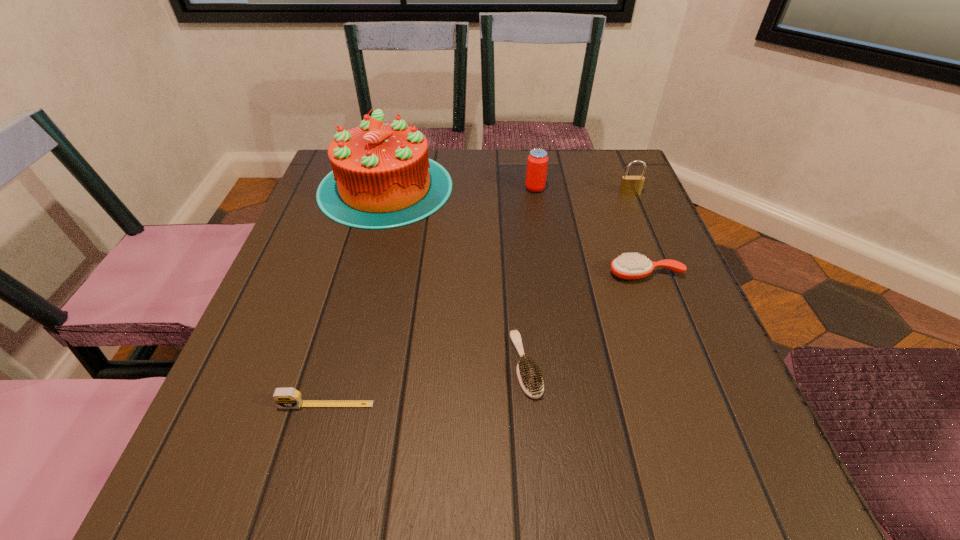
This screenshot has width=960, height=540. Find the location of `free spot located 0.240m on the left of the fourth farthest object`. free spot located 0.240m on the left of the fourth farthest object is located at coordinates (488, 274).

The height and width of the screenshot is (540, 960). In order to click on free space located at the front of the tape measure with the tape extended in this screenshot , I will do `click(299, 509)`.

Identify the location of free spot located on the left of the scrubbing brush. (310, 364).

Where is `cake present at the far edge`? This screenshot has height=540, width=960. cake present at the far edge is located at coordinates (382, 177).

You are a GUI agent. You are given a task and a screenshot of the screen. Output one action in this format:
    pyautogui.click(x=<x>, y=<y>)
    Task: Click on the beer can located in the far edge section of the desktop
    
    Given the screenshot: What is the action you would take?
    pyautogui.click(x=537, y=162)

The image size is (960, 540). I want to click on padlock situated at the far edge, so click(x=630, y=185).

At what (x,y) coordinates should I click in order to perform the action: click on cake that is at the left edge. Please return your answer as a coordinate pair (x, y). This screenshot has height=540, width=960. Looking at the image, I should click on (382, 177).

The image size is (960, 540). Find the location of `tape measure that is at the left edge`. tape measure that is at the left edge is located at coordinates (285, 398).

Find the location of a particular element. This screenshot has height=540, width=960. padlock situated at the right edge is located at coordinates (630, 185).

The width and height of the screenshot is (960, 540). In order to click on hairbrush that is at the right edge in this screenshot , I will do `click(630, 266)`.